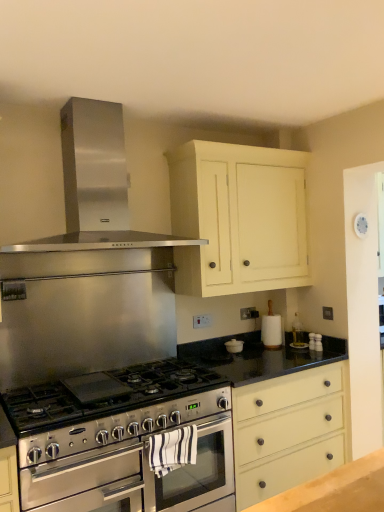
Question: Is matte cream drawer at center not inside stainless steel oven at center, marked as the 1th oven in a front-to-back arrangement?

Choices:
 (A) yes
 (B) no

Answer: (A)

Question: Considering the relative sizes of matte cream drawer at center and stainless steel oven at center, which appears as the second oven when viewed from the back, in the image provided, is matte cream drawer at center bigger than stainless steel oven at center, which appears as the second oven when viewed from the back,?

Choices:
 (A) no
 (B) yes

Answer: (B)

Question: From a real-world perspective, is matte cream drawer at center physically below stainless steel oven at center, which appears as the second oven when viewed from the back?

Choices:
 (A) yes
 (B) no

Answer: (B)

Question: Is matte cream drawer at center next to stainless steel oven at center, which appears as the second oven when viewed from the back, and touching it?

Choices:
 (A) yes
 (B) no

Answer: (B)

Question: Could you tell me if matte cream drawer at center is facing stainless steel oven at center, which appears as the second oven when viewed from the back?

Choices:
 (A) yes
 (B) no

Answer: (B)

Question: Relative to stainless steel oven at center, the 1th oven in the back-to-front sequence, is stainless steel oven at center, marked as the 1th oven in a front-to-back arrangement, in front or behind?

Choices:
 (A) behind
 (B) front

Answer: (B)

Question: Visually, is stainless steel oven at center, marked as the 1th oven in a front-to-back arrangement, positioned to the left or to the right of stainless steel oven at center, the 1th oven in the back-to-front sequence?

Choices:
 (A) right
 (B) left

Answer: (B)

Question: From the image's perspective, relative to stainless steel oven at center, the 1th oven in the back-to-front sequence, is stainless steel oven at center, which appears as the second oven when viewed from the back, above or below?

Choices:
 (A) below
 (B) above

Answer: (A)

Question: In terms of width, does stainless steel oven at center, which appears as the second oven when viewed from the back, look wider or thinner when compared to stainless steel oven at center, the 1th oven in the back-to-front sequence?

Choices:
 (A) wide
 (B) thin

Answer: (A)

Question: Considering the positions of point (140, 403) and point (142, 443), is point (140, 403) closer or farther from the camera than point (142, 443)?

Choices:
 (A) farther
 (B) closer

Answer: (A)

Question: Is stainless steel gas stove at center bigger or smaller than stainless steel oven at center, which appears as the second oven when viewed from the back?

Choices:
 (A) big
 (B) small

Answer: (B)

Question: In terms of width, does stainless steel gas stove at center look wider or thinner when compared to stainless steel oven at center, marked as the 1th oven in a front-to-back arrangement?

Choices:
 (A) thin
 (B) wide

Answer: (A)

Question: Considering the positions of stainless steel gas stove at center and stainless steel oven at center, marked as the 1th oven in a front-to-back arrangement, in the image, is stainless steel gas stove at center taller or shorter than stainless steel oven at center, marked as the 1th oven in a front-to-back arrangement,?

Choices:
 (A) tall
 (B) short

Answer: (B)

Question: Based on their positions, is matte cream drawer at center located to the left or right of stainless steel oven at center, the 1th oven in the back-to-front sequence?

Choices:
 (A) right
 (B) left

Answer: (A)

Question: Considering the positions of matte cream drawer at center and stainless steel oven at center, arranged as the second oven when viewed from the front, in the image, is matte cream drawer at center bigger or smaller than stainless steel oven at center, arranged as the second oven when viewed from the front,?

Choices:
 (A) big
 (B) small

Answer: (A)